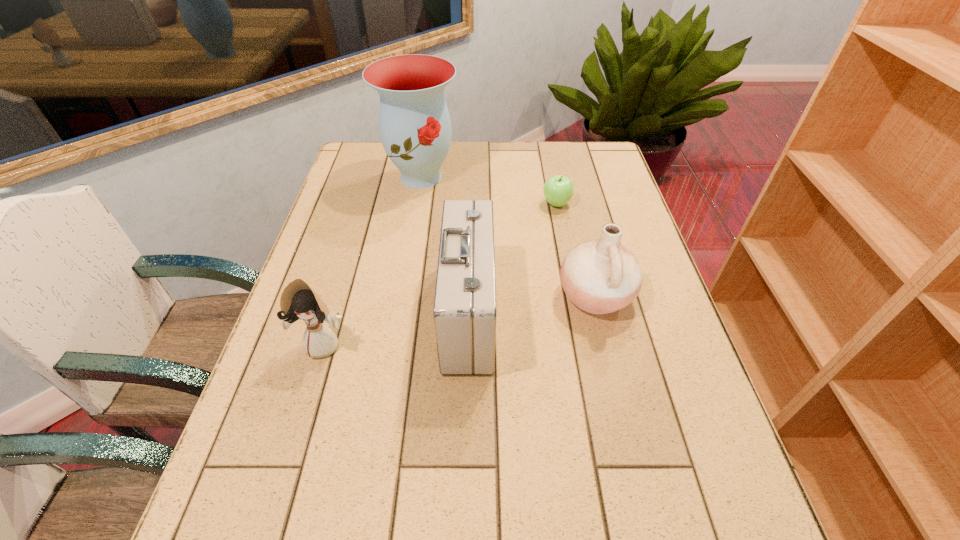
Locate an element on the screen. free space at the far right corner is located at coordinates (607, 174).

I want to click on vacant space at the near right corner, so click(x=686, y=530).

Where is `vacant point located between the shortest object and the tallest object`? vacant point located between the shortest object and the tallest object is located at coordinates (489, 190).

The image size is (960, 540). In order to click on empty space that is in between the first-aid kit and the doll in this screenshot , I will do `click(396, 328)`.

You are a GUI agent. You are given a task and a screenshot of the screen. Output one action in this format:
    pyautogui.click(x=<x>, y=<y>)
    Task: Click on the free spot between the pottery and the vase
    
    Given the screenshot: What is the action you would take?
    pyautogui.click(x=508, y=236)

This screenshot has height=540, width=960. I want to click on free area in between the first-aid kit and the doll, so click(x=396, y=328).

Identify the location of free space between the vase and the doll. tap(372, 260).

The width and height of the screenshot is (960, 540). I want to click on free spot between the shortest object and the first-aid kit, so click(513, 258).

Locate which object is the third closest to the tallest object. Please provide its 2D coordinates. Your answer should be formatted as a tuple, i.e. [(x, y)], where the tuple contains the x and y coordinates of a point satisfying the conditions above.

[(600, 276)]

At what (x,y) coordinates should I click in order to perform the action: click on object that ranks as the fourth closest to the vase. Please return your answer as a coordinate pair (x, y). Looking at the image, I should click on (299, 301).